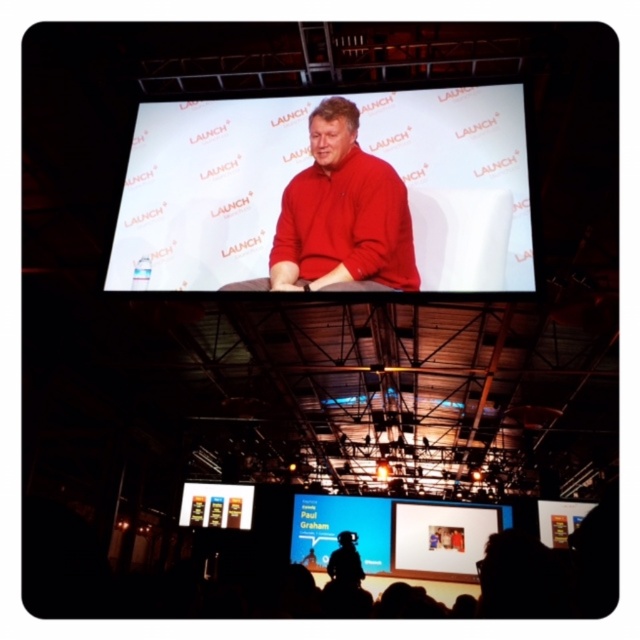
Question: Observing the image, what is the correct spatial positioning of matte white screen at center in reference to silhouette figure at center?

Choices:
 (A) right
 (B) left

Answer: (B)

Question: Which of the following is the closest to the observer?

Choices:
 (A) (337, 548)
 (B) (212, 106)

Answer: (B)

Question: In this image, where is matte white screen at center located relative to silhouette figure at center?

Choices:
 (A) below
 (B) above

Answer: (B)

Question: Is the position of matte white screen at center less distant than that of silhouette figure at center?

Choices:
 (A) no
 (B) yes

Answer: (B)